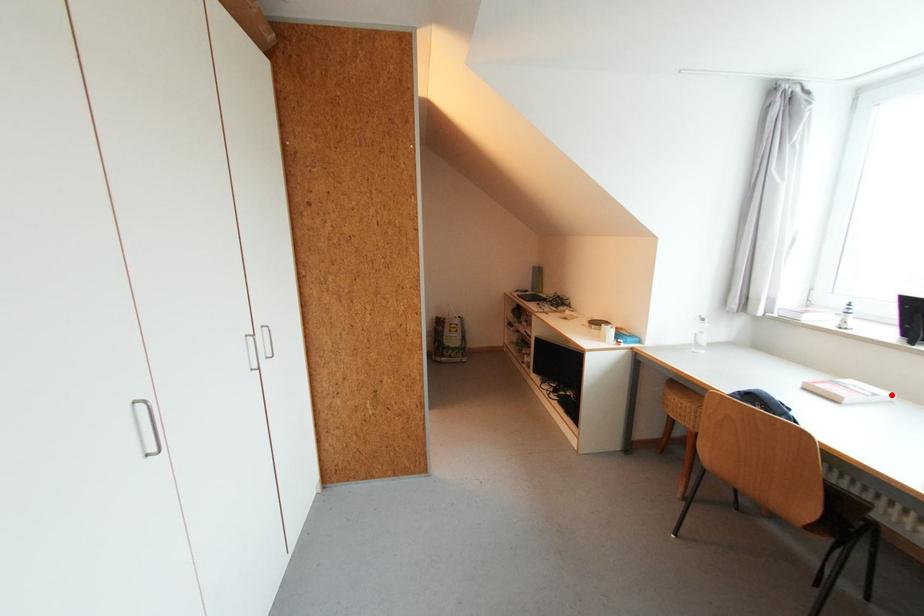
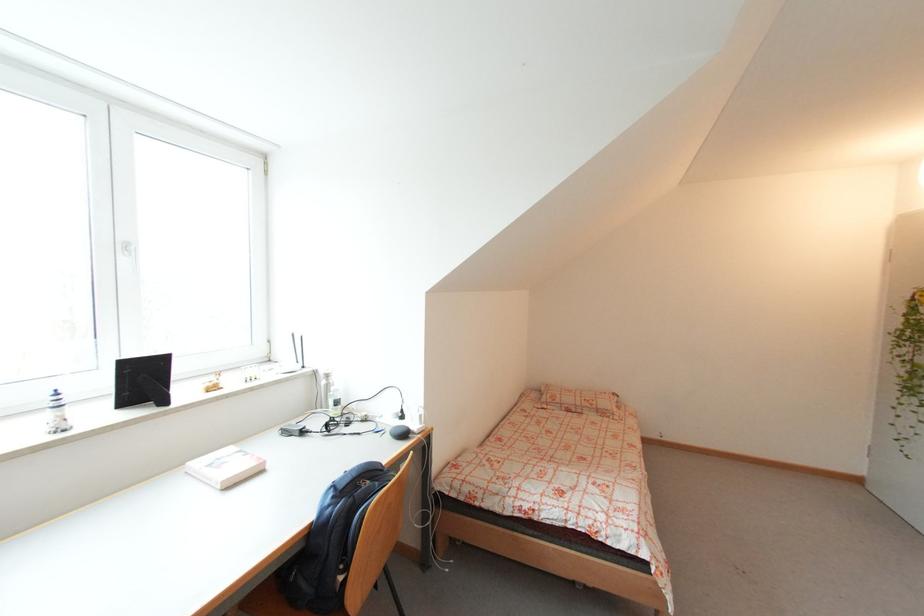
Question: I am providing you with two images of the same scene from different viewpoints. In image1, a red point is highlighted. Considering the same 3D point in image2, which of the following is correct?

Choices:
 (A) It is closer
 (B) It is farther

Answer: (A)